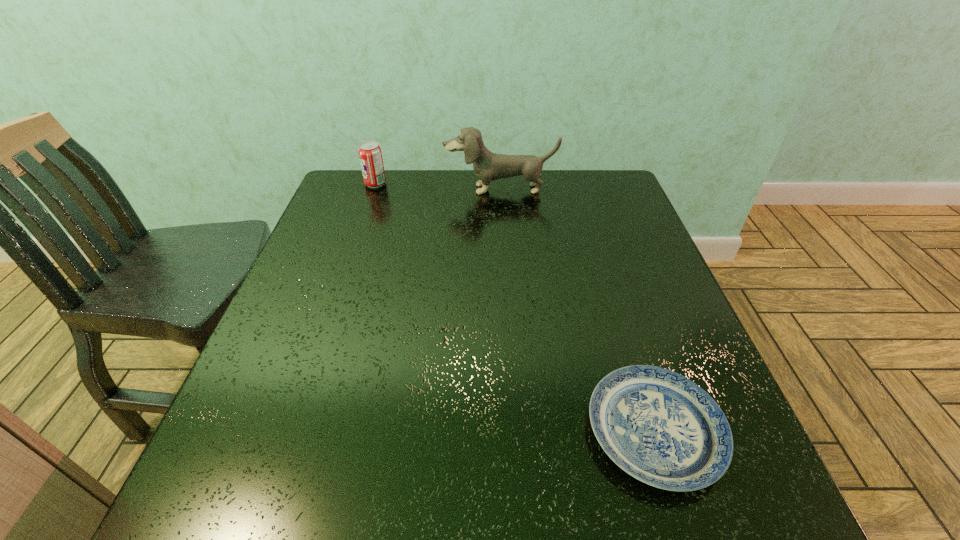
Identify the location of object present at the near edge. (660, 427).

Find the location of a particular element. object that is at the left edge is located at coordinates (370, 155).

You are a GUI agent. You are given a task and a screenshot of the screen. Output one action in this format:
    pyautogui.click(x=<x>, y=<y>)
    Task: Click on the object present at the right edge
    The image size is (960, 540).
    Given the screenshot: What is the action you would take?
    pyautogui.click(x=660, y=427)

The height and width of the screenshot is (540, 960). I want to click on object situated at the far left corner, so click(x=370, y=155).

At what (x,y) coordinates should I click in order to perform the action: click on object positioned at the near right corner. Please return your answer as a coordinate pair (x, y). This screenshot has height=540, width=960. Looking at the image, I should click on (660, 427).

The image size is (960, 540). Identify the location of vacant space at the far edge of the desktop. click(436, 198).

Locate an element on the screen. This screenshot has height=540, width=960. vacant space at the near edge of the desktop is located at coordinates (566, 496).

In order to click on free region at the left edge of the desktop in this screenshot , I will do `click(300, 276)`.

Where is `vacant space at the far left corner of the desktop`? vacant space at the far left corner of the desktop is located at coordinates (354, 213).

The image size is (960, 540). In the image, there is a desktop. Identify the location of blank space at the near left corner. (234, 476).